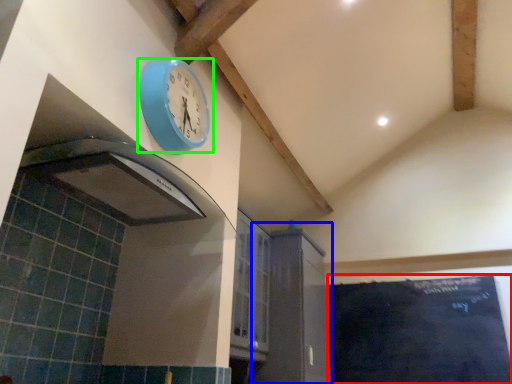
Question: Which object is the farthest from bulletin board (highlighted by a red box)? Choose among these: cabinetry (highlighted by a blue box) or wall clock (highlighted by a green box).

Choices:
 (A) cabinetry
 (B) wall clock

Answer: (B)